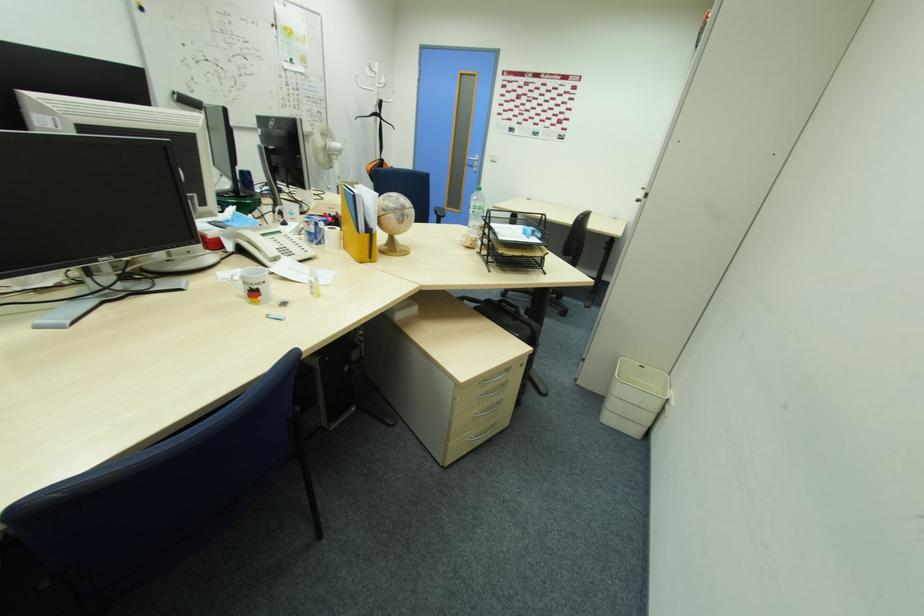
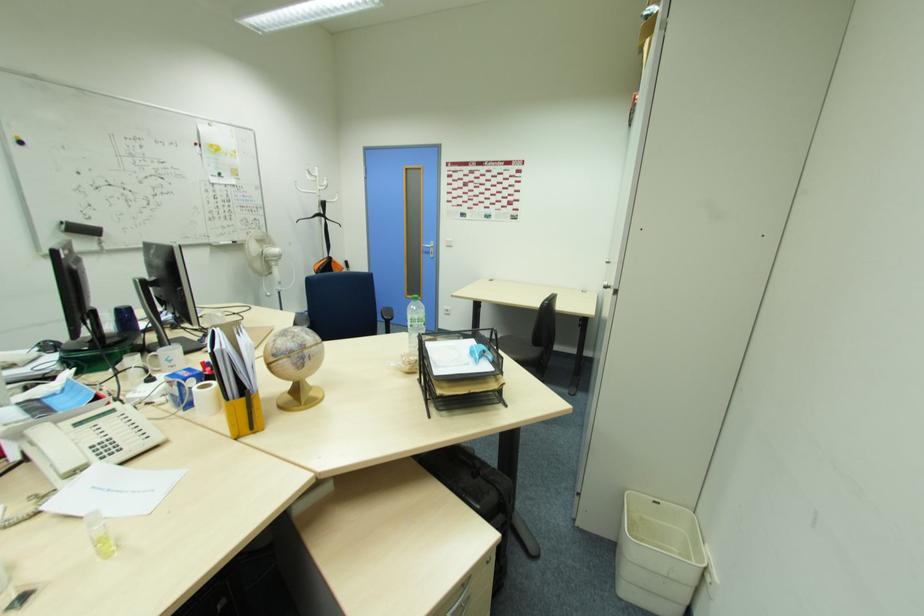
In the second image, find the point that corresponds to the point at 441,213 in the first image.

(386, 315)